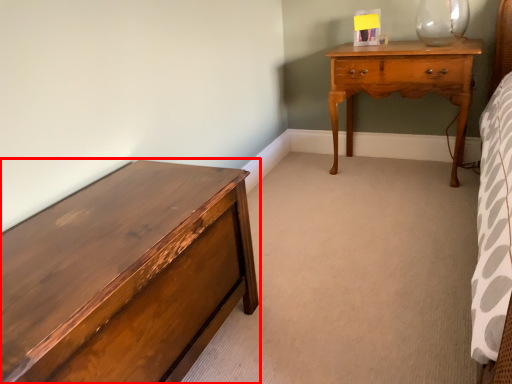
Question: From the image's perspective, what is the correct spatial positioning of chest of drawers (annotated by the red box) in reference to nightstand?

Choices:
 (A) above
 (B) below

Answer: (B)